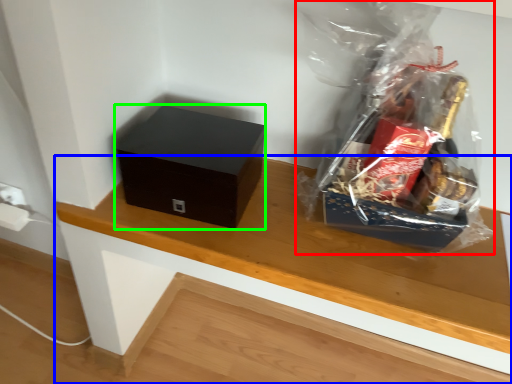
Question: Based on their relative distances, which object is farther from plastic bag (highlighted by a red box)? Choose from table (highlighted by a blue box) and box (highlighted by a green box).

Choices:
 (A) table
 (B) box

Answer: (B)